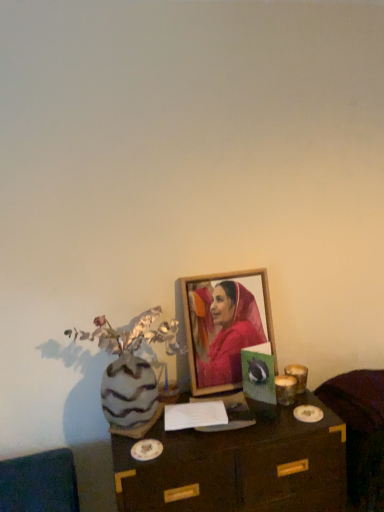
Question: From a real-world perspective, is wooden table at center located higher than wooden picture frame at center?

Choices:
 (A) yes
 (B) no

Answer: (B)

Question: Is wooden table at center looking in the opposite direction of wooden picture frame at center?

Choices:
 (A) no
 (B) yes

Answer: (A)

Question: Is wooden table at center at the right side of wooden picture frame at center?

Choices:
 (A) yes
 (B) no

Answer: (B)

Question: Is wooden table at center positioned behind wooden picture frame at center?

Choices:
 (A) no
 (B) yes

Answer: (A)

Question: Considering the relative sizes of wooden table at center and wooden picture frame at center in the image provided, is wooden table at center smaller than wooden picture frame at center?

Choices:
 (A) yes
 (B) no

Answer: (B)

Question: From a real-world perspective, is velvet dark brown armchair at lower right physically located above or below wooden picture frame at center?

Choices:
 (A) below
 (B) above

Answer: (A)

Question: Is velvet dark brown armchair at lower right wider or thinner than wooden picture frame at center?

Choices:
 (A) wide
 (B) thin

Answer: (A)

Question: Would you say velvet dark brown armchair at lower right is to the left or to the right of wooden picture frame at center in the picture?

Choices:
 (A) left
 (B) right

Answer: (B)

Question: Considering the positions of velvet dark brown armchair at lower right and wooden picture frame at center in the image, is velvet dark brown armchair at lower right taller or shorter than wooden picture frame at center?

Choices:
 (A) tall
 (B) short

Answer: (B)

Question: From the image's perspective, is velvet dark brown armchair at lower right positioned above or below wooden table at center?

Choices:
 (A) below
 (B) above

Answer: (B)

Question: In the image, is velvet dark brown armchair at lower right on the left side or the right side of wooden table at center?

Choices:
 (A) left
 (B) right

Answer: (B)

Question: Is velvet dark brown armchair at lower right in front of or behind wooden table at center in the image?

Choices:
 (A) front
 (B) behind

Answer: (B)

Question: From a real-world perspective, relative to wooden table at center, is velvet dark brown armchair at lower right vertically above or below?

Choices:
 (A) above
 (B) below

Answer: (A)

Question: From a real-world perspective, is wooden table at center positioned above or below velvet dark brown armchair at lower right?

Choices:
 (A) above
 (B) below

Answer: (B)

Question: Is wooden table at center wider or thinner than velvet dark brown armchair at lower right?

Choices:
 (A) thin
 (B) wide

Answer: (B)